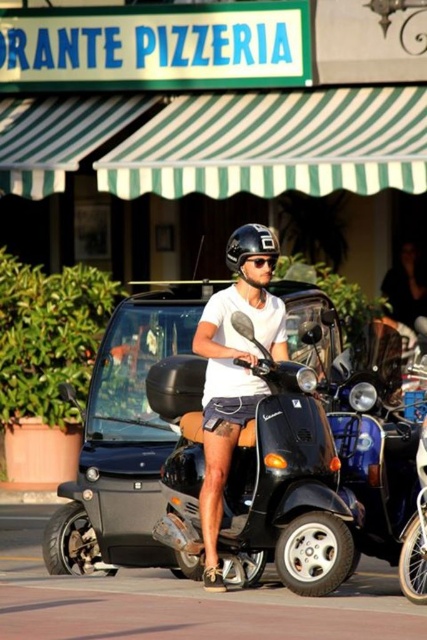
Is shiny black scooter at center positioned before matte white helmet at center?

No, shiny black scooter at center is further to the viewer.

Between shiny black scooter at center and matte white helmet at center, which one is positioned lower?

shiny black scooter at center is lower down.

Which is in front, point (342, 392) or point (237, 344)?

Positioned in front is point (342, 392).

I want to click on shiny black scooter at center, so click(x=382, y=458).

Who is lower down, black matte scooter at center or matte white helmet at center?

black matte scooter at center is lower down.

Does black matte scooter at center have a lesser height compared to matte white helmet at center?

Yes.

Between point (312, 588) and point (219, 472), which one is positioned behind?

Point (219, 472)

Locate an element on the screen. black matte scooter at center is located at coordinates (286, 486).

Where is `matte white helmet at center`? This screenshot has width=427, height=640. matte white helmet at center is located at coordinates (233, 369).

This screenshot has height=640, width=427. What do you see at coordinates (233, 369) in the screenshot?
I see `matte white helmet at center` at bounding box center [233, 369].

The width and height of the screenshot is (427, 640). I want to click on matte white helmet at center, so click(233, 369).